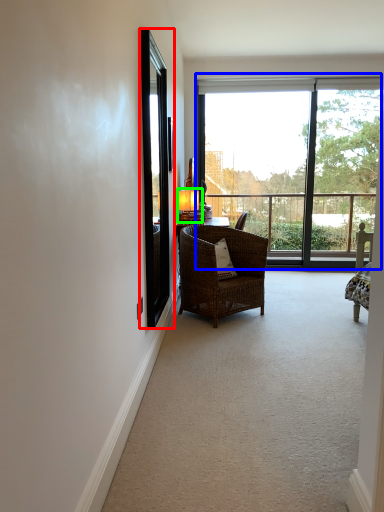
Question: Which is farther away from screen door (highlighted by a red box)? window (highlighted by a blue box) or table lamp (highlighted by a green box)?

Choices:
 (A) window
 (B) table lamp

Answer: (A)